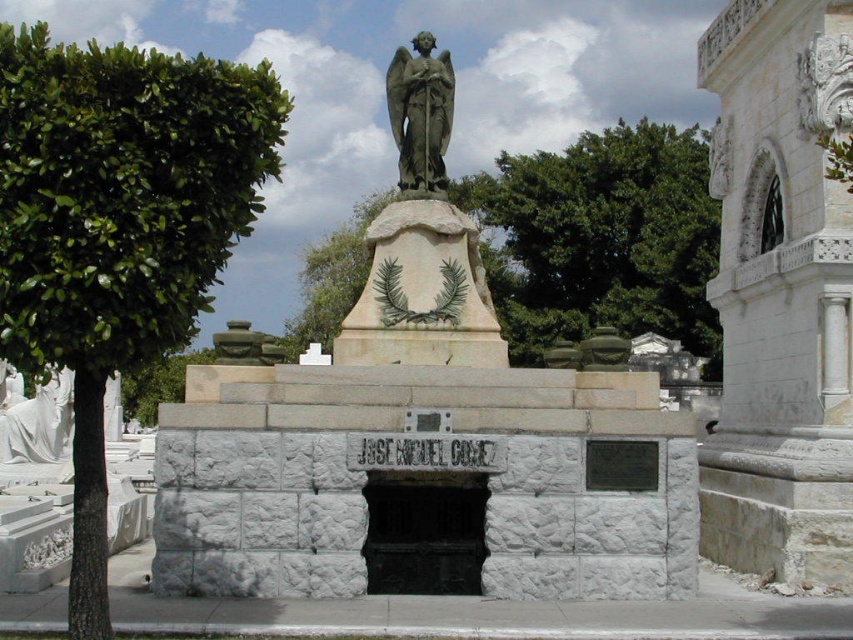
You are visiting the cemetery and want to take a photo of the matte stone angel at center. You notice the green leafy tree at left might block the view. Based on their heights, will the tree obstruct the angel in your photo?

The green leafy tree at left is taller than matte stone angel at center, so it might obstruct the angel in your photo depending on their distance from the camera.

You are visiting a cemetery and see the matte stone angel at center and the green stone angel at center. Which one is located higher up?

The matte stone angel at center is positioned under the green stone angel at center, so the green stone angel at center is located higher up.